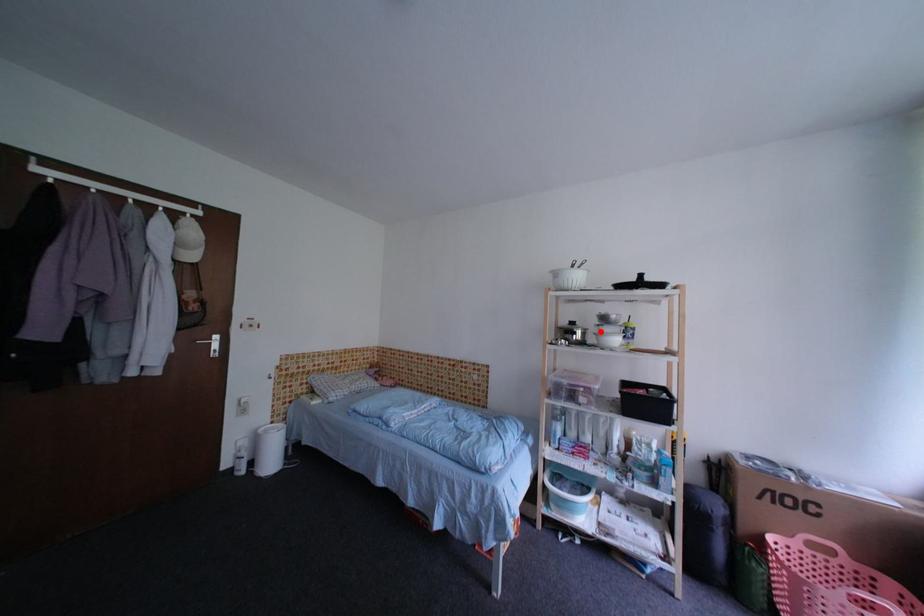
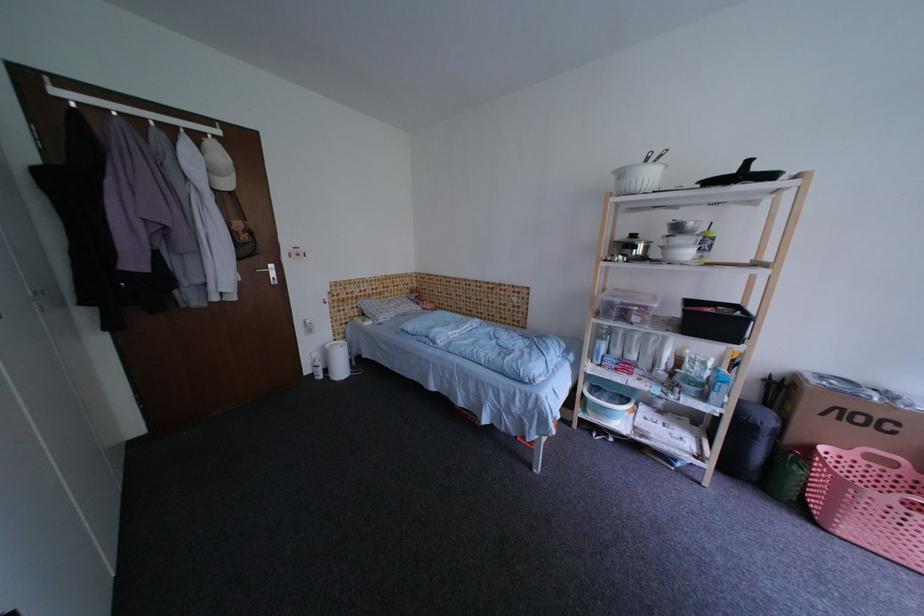
Find the pixel in the second image that matches the highlighted location in the first image.

(666, 245)